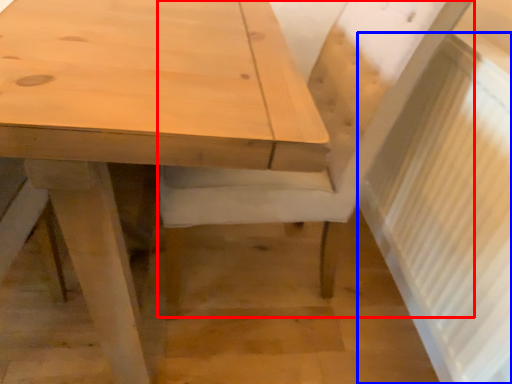
Question: Which point is further to the camera, chair (highlighted by a red box) or radiator (highlighted by a blue box)?

Choices:
 (A) chair
 (B) radiator

Answer: (A)